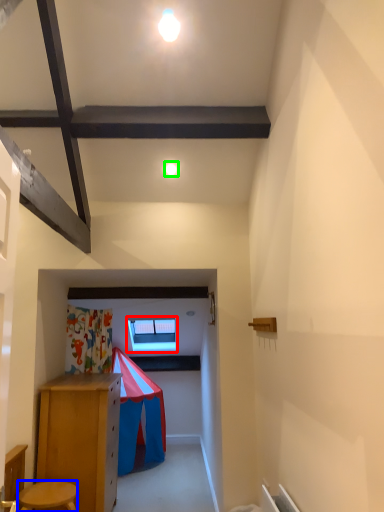
Question: Based on their relative distances, which object is farther from window (highlighted by a red box)? Choose from stool (highlighted by a blue box) and light (highlighted by a green box).

Choices:
 (A) stool
 (B) light

Answer: (B)